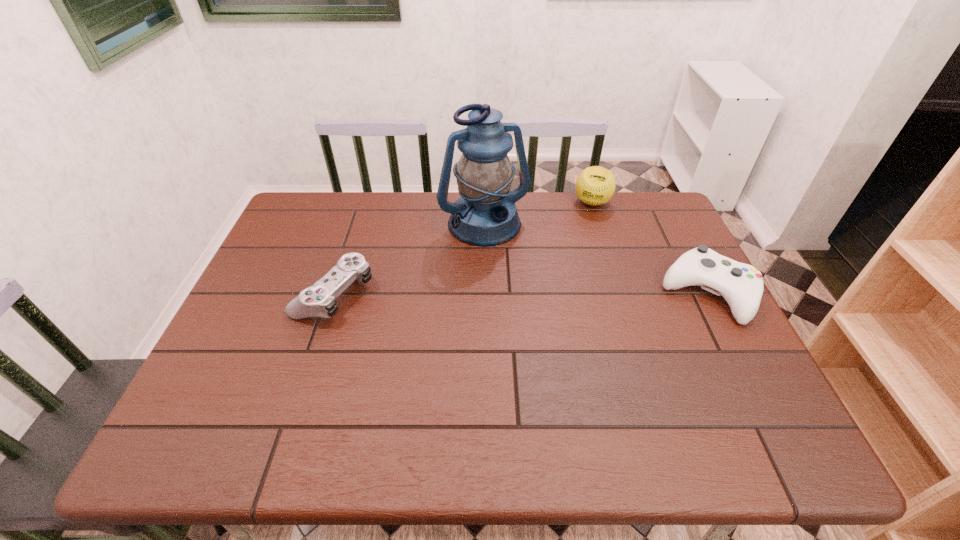
Where is `the left control`? The image size is (960, 540). the left control is located at coordinates (319, 300).

Where is `the right control`? This screenshot has height=540, width=960. the right control is located at coordinates (741, 285).

Where is `lantern`? This screenshot has width=960, height=540. lantern is located at coordinates (485, 214).

You are a GUI agent. You are given a task and a screenshot of the screen. Output one action in this format:
    pyautogui.click(x=<x>, y=<y>)
    Task: Click on the tallest object
    
    Given the screenshot: What is the action you would take?
    pyautogui.click(x=485, y=214)

The image size is (960, 540). I want to click on softball, so click(595, 185).

Locate an element on the screen. Image resolution: width=960 pixels, height=540 pixels. the third shortest object is located at coordinates (595, 185).

The width and height of the screenshot is (960, 540). Find the location of `blank area located on the back of the left control`. blank area located on the back of the left control is located at coordinates (355, 231).

Where is `vacant point located on the back of the rightmost object`? The image size is (960, 540). vacant point located on the back of the rightmost object is located at coordinates (683, 243).

Locate an element on the screen. The image size is (960, 540). blank space located 0.310m on the face of the third object from right to left is located at coordinates (545, 329).

The image size is (960, 540). I want to click on blank space located 0.150m on the face of the third object from right to left, so click(x=520, y=285).